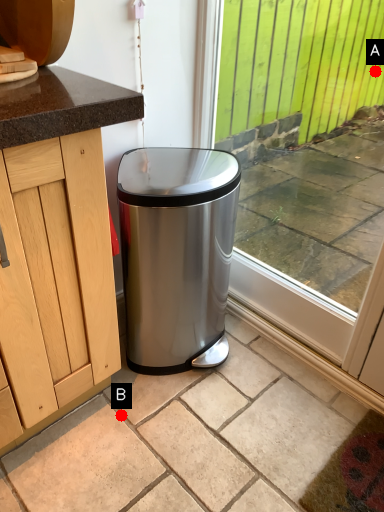
Question: Two points are circled on the image, labeled by A and B beside each circle. Which point is closer to the camera?

Choices:
 (A) A is closer
 (B) B is closer

Answer: (B)